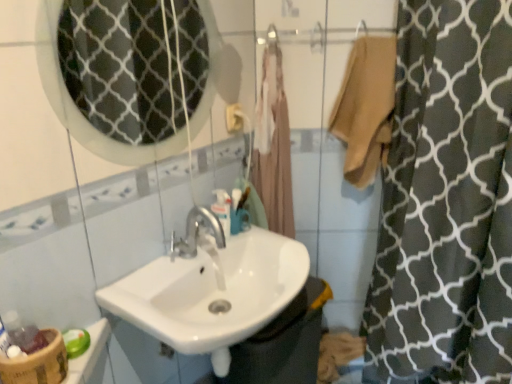
Question: Is translucent plastic mouthwash at center wider or thinner than white glossy sink at center?

Choices:
 (A) wide
 (B) thin

Answer: (B)

Question: Based on their sizes in the image, would you say translucent plastic mouthwash at center is bigger or smaller than white glossy sink at center?

Choices:
 (A) small
 (B) big

Answer: (A)

Question: Estimate the real-world distances between objects in this image. Which object is closer to the translucent plastic mouthwash at center?

Choices:
 (A) white glossy mirror at upper center
 (B) white glossy sink at center
 (C) bamboo textured basket at lower left
 (D) beige cotton towel at upper right
 (E) beige fabric bathrobe at center

Answer: (B)

Question: Which object is positioned closest to the white glossy mirror at upper center?

Choices:
 (A) bamboo textured basket at lower left
 (B) beige fabric bathrobe at center
 (C) beige cotton towel at upper right
 (D) translucent plastic mouthwash at center
 (E) white glossy sink at center

Answer: (B)